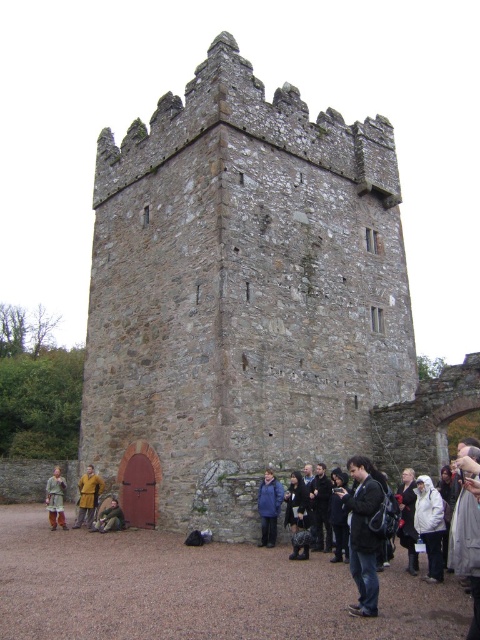
Based on the photo, you are standing at the base of the medieval stone tower and want to take a photo of the point at coordinates point (377, 173). If your camera has a maximum focus range of 50 meters, will it be able to focus on that point?

The distance of point (377, 173) from the camera is 49.95 meters, which is within the camera maximum focus range of 50 meters. Therefore, the camera can focus on that point.